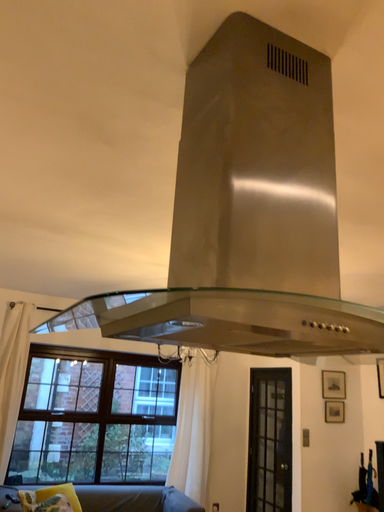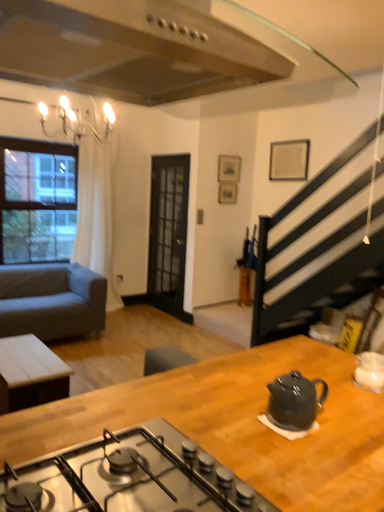
Question: How did the camera likely rotate when shooting the video?

Choices:
 (A) rotated left
 (B) rotated right

Answer: (B)